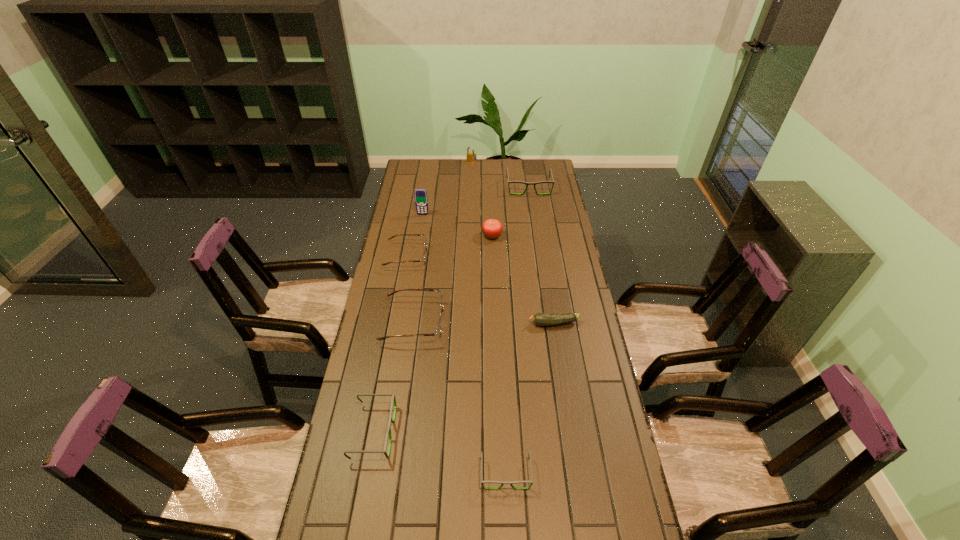
Identify the location of free space that is in between the shortest spectacles and the apple. The height and width of the screenshot is (540, 960). point(499,354).

Locate an element on the screen. The image size is (960, 540). vacant point located between the smallest black spectacles and the green zucchini is located at coordinates (530, 399).

Locate an element on the screen. The height and width of the screenshot is (540, 960). empty space that is in between the smallest black spectacles and the farthest black spectacles is located at coordinates (517, 330).

Where is `vacant space that's between the smaller brown spectacles and the farthest object`? The width and height of the screenshot is (960, 540). vacant space that's between the smaller brown spectacles and the farthest object is located at coordinates click(439, 210).

Where is `vacant point located between the fifth object from left to right and the green zucchini`? The image size is (960, 540). vacant point located between the fifth object from left to right and the green zucchini is located at coordinates (513, 243).

Locate which object is the third closest to the leftmost black spectacles. Please provide its 2D coordinates. Your answer should be formatted as a tuple, i.e. [(x, y)], where the tuple contains the x and y coordinates of a point satisfying the conditions above.

[(541, 319)]

Identify which object is the fifth nearest to the zucchini. Please provide its 2D coordinates. Your answer should be formatted as a tuple, i.e. [(x, y)], where the tuple contains the x and y coordinates of a point satisfying the conditions above.

[(393, 400)]

This screenshot has height=540, width=960. Identify the location of spectacles identified as the fifth closest to the zucchini. (527, 183).

Locate an element on the screen. the second closest spectacles to the bigger brown spectacles is located at coordinates (393, 400).

Locate which black spectacles is the second closest to the shortest spectacles. Please provide its 2D coordinates. Your answer should be formatted as a tuple, i.e. [(x, y)], where the tuple contains the x and y coordinates of a point satisfying the conditions above.

[(527, 183)]